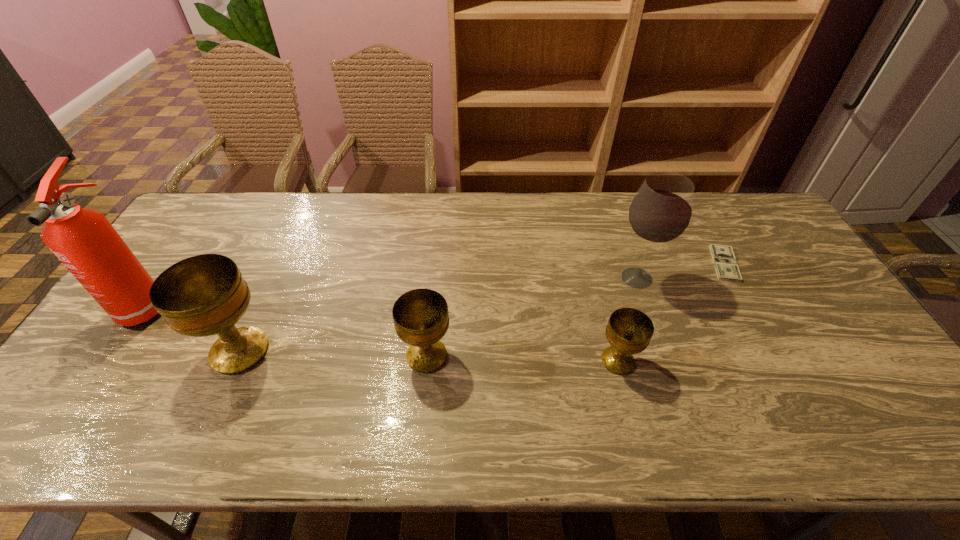
Where is `the leftmost chalice`? This screenshot has width=960, height=540. the leftmost chalice is located at coordinates (204, 295).

In order to click on the third tallest object in this screenshot , I will do `click(204, 295)`.

You are a GUI agent. You are given a task and a screenshot of the screen. Output one action in this format:
    pyautogui.click(x=<x>, y=<y>)
    Task: Click on the second chalice from left to right
    Image resolution: width=960 pixels, height=540 pixels.
    Given the screenshot: What is the action you would take?
    pyautogui.click(x=421, y=319)

Locate an element on the screen. The image size is (960, 540). the third object from left to right is located at coordinates (421, 319).

Locate an element on the screen. the fifth tallest object is located at coordinates (629, 331).

Locate an element on the screen. The width and height of the screenshot is (960, 540). the rightmost chalice is located at coordinates (629, 331).

Locate an element on the screen. The height and width of the screenshot is (540, 960). the rightmost object is located at coordinates (725, 263).

Locate an element on the screen. the shortest object is located at coordinates (725, 263).

The height and width of the screenshot is (540, 960). Identify the location of fire extinguisher. (86, 243).

You are a GUI agent. You are given a task and a screenshot of the screen. Output one action in this format:
    pyautogui.click(x=<x>, y=<y>)
    Task: Click on the leftmost object
    Image resolution: width=960 pixels, height=540 pixels.
    Given the screenshot: What is the action you would take?
    pyautogui.click(x=86, y=243)